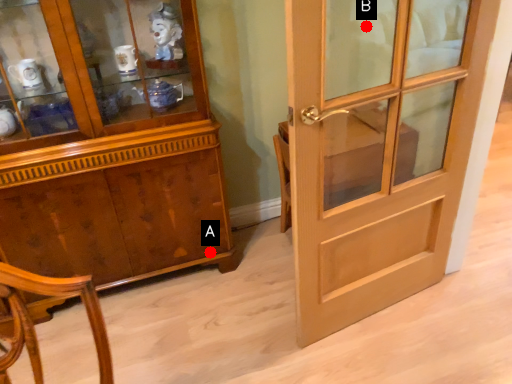
Question: Two points are circled on the image, labeled by A and B beside each circle. Which point is farther to the camera?

Choices:
 (A) A is further
 (B) B is further

Answer: (A)